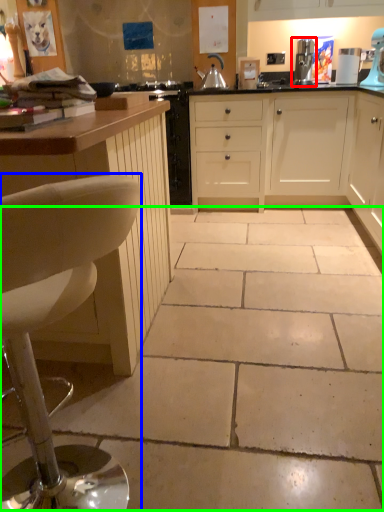
Question: Which object is the farthest from kitchen appliance (highlighted by a red box)? Choose among these: chair (highlighted by a blue box) or concrete (highlighted by a green box).

Choices:
 (A) chair
 (B) concrete

Answer: (A)